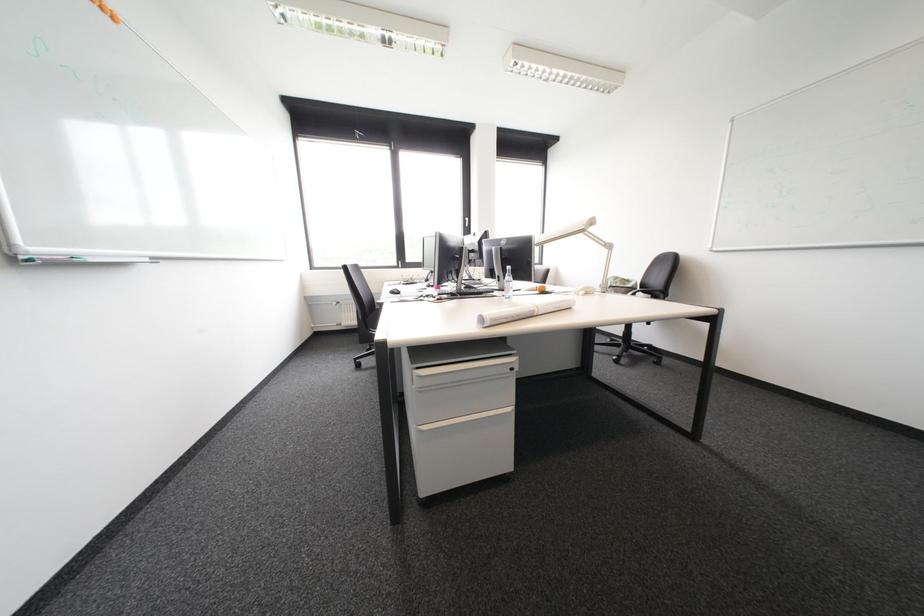
Locate an element on the screen. The width and height of the screenshot is (924, 616). the top drawer handle is located at coordinates (465, 382).